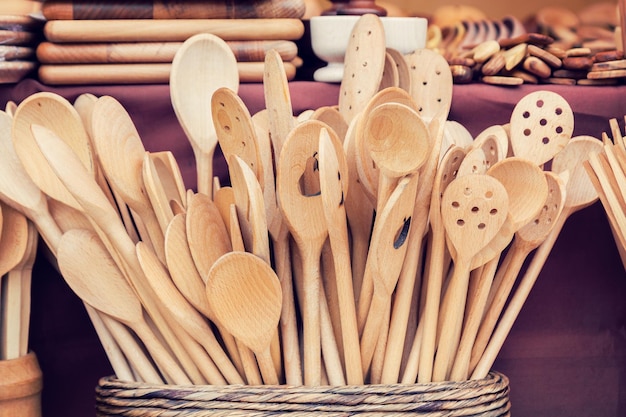
Locate an element on the screen. The width and height of the screenshot is (626, 417). cutting board is located at coordinates (129, 8), (131, 32), (121, 53), (121, 70).